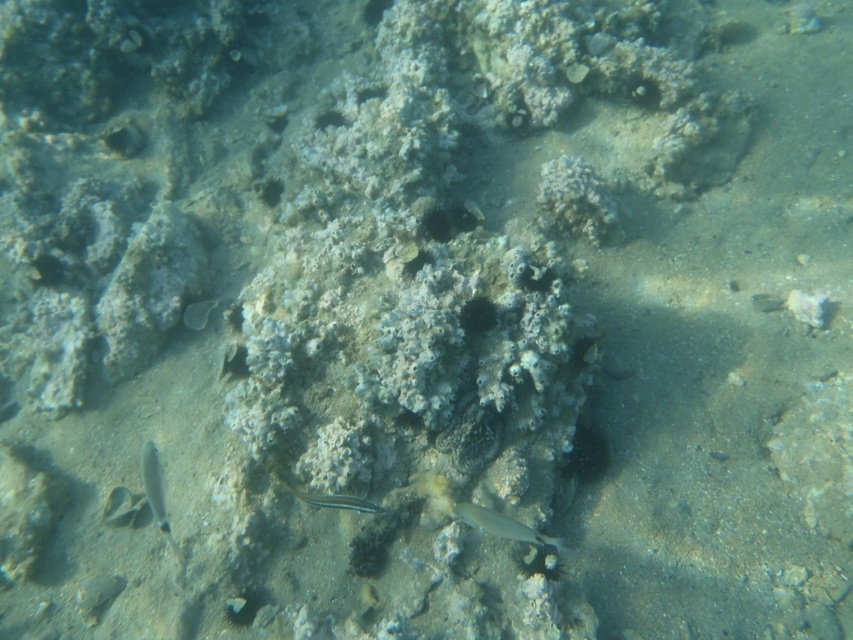
You are a marine biologist observing an underwater scene. You see a silvery metallic fish at center. If you want to approach it without startling it, you should stay at least 6 feet away. Can you safely approach it from your current position?

The silvery metallic fish at center and the viewer are 5.70 feet apart from each other. Since 5.70 feet is less than 6 feet, you are too close to safely approach without startling it. You should maintain a distance of at least 6 feet.

Looking at this image, you are a marine biologist observing the underwater scene. You notice the silvery metallic fish at center and the translucent silver fish at lower left. Which fish takes up more space in the image?

The translucent silver fish at lower left takes up more space in the image than the silvery metallic fish at center.

You are a scuba diver observing the underwater scene. You notice the silvery metallic fish at center and the translucent silver fish at lower left. Which fish is closer to you?

The silvery metallic fish at center is closer to you because it is positioned in front of the translucent silver fish at lower left.